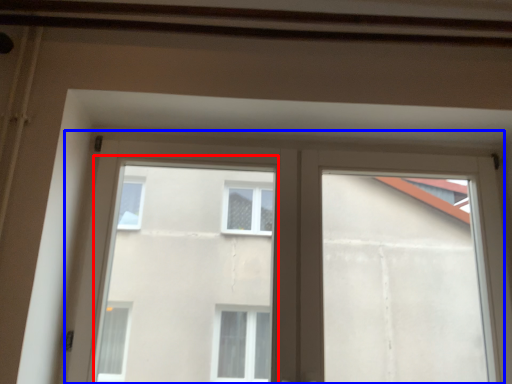
Question: Among these objects, which one is farthest to the camera, bay window (highlighted by a red box) or window (highlighted by a blue box)?

Choices:
 (A) bay window
 (B) window

Answer: (B)